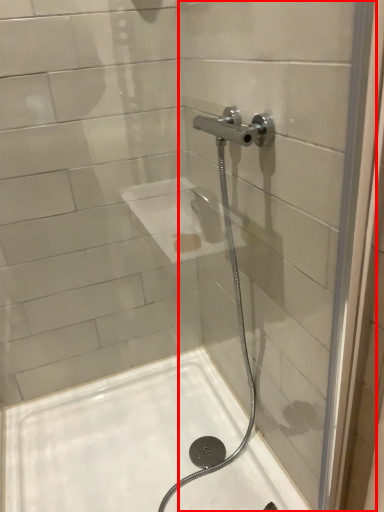
Question: From the image, what is the correct spatial relationship of glass door (annotated by the red box) in relation to bath?

Choices:
 (A) right
 (B) left

Answer: (A)